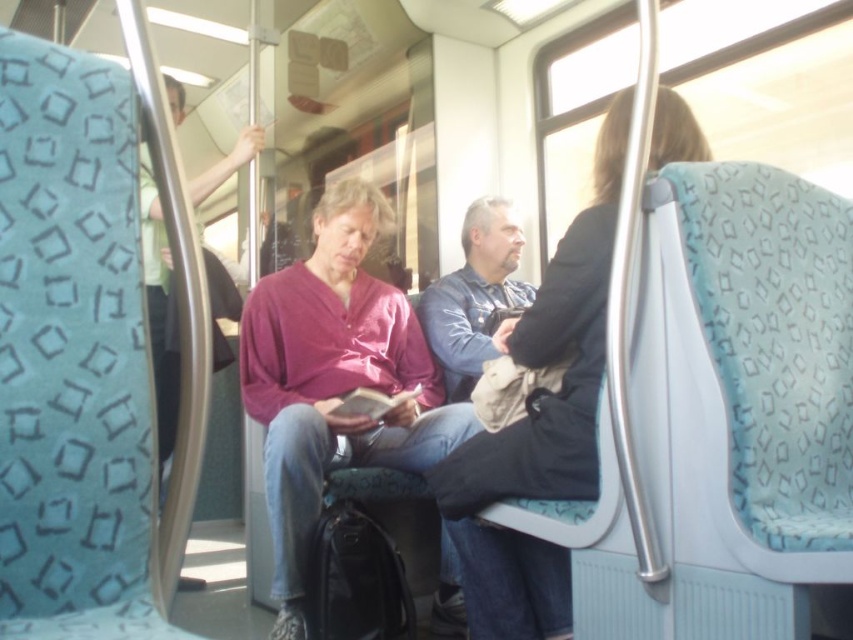
You are a passenger on a train and need to place a 12 inch wide backpack between the matte purple sweater at center and the blue denim jacket at center. Can the backpack fit in the space between them?

The space between the matte purple sweater at center and the blue denim jacket at center is 13.27 inches. Since the backpack is 12 inches wide, it can fit in the space between them because 12 inches is less than 13.27 inches.

In the scene shown: You are a passenger on this train and want to sit down. There are two seats available next to the matte purple sweater at center and the blue denim jacket at center. Which seat would you choose if you want more space?

You should choose the seat next to the matte purple sweater at center because its width is larger than the blue denim jacket at center, providing more space.

From the picture: You are a passenger on the train and want to reach the window on the right side to take a photo. There are two items in your way at the center of the seat in front of you. Which item is closer to you so you can move it first? The items are the matte purple sweater at center and the black fabric jacket at center.

The matte purple sweater at center is closer to you because the black fabric jacket at center is behind it, so move the matte purple sweater at center first.